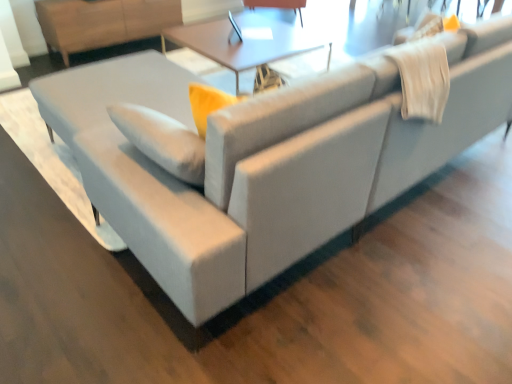
Question: Can you confirm if matte white table at center is positioned to the right of matte black swivel chair at upper center?

Choices:
 (A) yes
 (B) no

Answer: (B)

Question: Is matte white table at center facing towards matte black swivel chair at upper center?

Choices:
 (A) no
 (B) yes

Answer: (A)

Question: Is matte white table at center taller than matte black swivel chair at upper center?

Choices:
 (A) no
 (B) yes

Answer: (B)

Question: From the image's perspective, is matte white table at center under matte black swivel chair at upper center?

Choices:
 (A) no
 (B) yes

Answer: (B)

Question: From a real-world perspective, is matte white table at center below matte black swivel chair at upper center?

Choices:
 (A) no
 (B) yes

Answer: (A)

Question: Does matte white table at center lie behind matte black swivel chair at upper center?

Choices:
 (A) yes
 (B) no

Answer: (B)

Question: Considering the relative positions of matte black swivel chair at upper center and light brown wood dresser at upper left in the image provided, is matte black swivel chair at upper center to the left of light brown wood dresser at upper left from the viewer's perspective?

Choices:
 (A) yes
 (B) no

Answer: (B)

Question: Can you confirm if matte black swivel chair at upper center is shorter than light brown wood dresser at upper left?

Choices:
 (A) no
 (B) yes

Answer: (B)

Question: Is matte black swivel chair at upper center completely or partially outside of light brown wood dresser at upper left?

Choices:
 (A) yes
 (B) no

Answer: (A)

Question: From a real-world perspective, is matte black swivel chair at upper center over light brown wood dresser at upper left?

Choices:
 (A) yes
 (B) no

Answer: (B)

Question: From the image's perspective, is matte black swivel chair at upper center below light brown wood dresser at upper left?

Choices:
 (A) yes
 (B) no

Answer: (B)

Question: Is matte black swivel chair at upper center thinner than light brown wood dresser at upper left?

Choices:
 (A) no
 (B) yes

Answer: (A)

Question: Is light brown wood dresser at upper left aimed at matte white table at center?

Choices:
 (A) no
 (B) yes

Answer: (B)